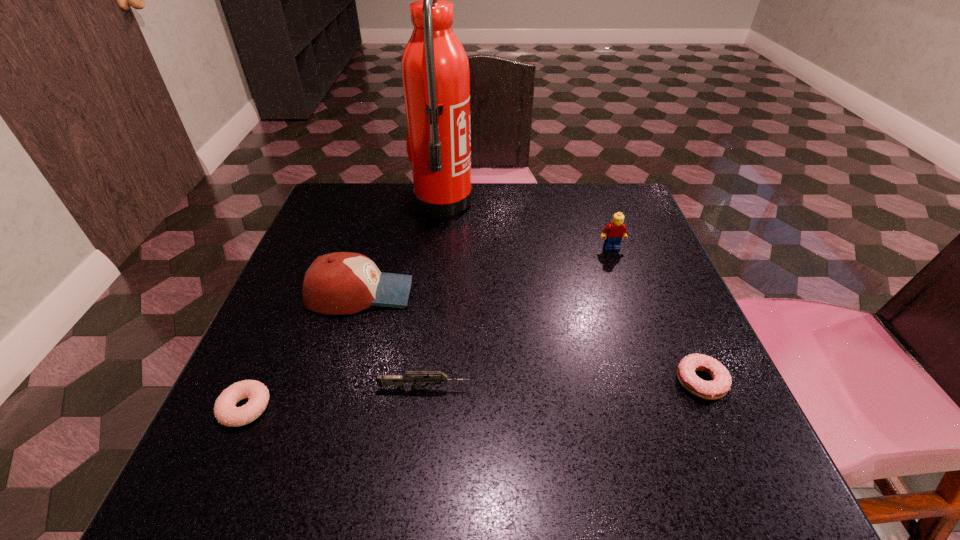
The image size is (960, 540). In the image, there is a desktop. In order to click on vacant area at the right edge in this screenshot , I will do `click(750, 436)`.

The height and width of the screenshot is (540, 960). What are the coordinates of `vacant space at the far right corner of the desktop` in the screenshot? It's located at (642, 226).

Where is `free space between the right doughnut and the fourth tallest object`? The image size is (960, 540). free space between the right doughnut and the fourth tallest object is located at coordinates coord(563,386).

You are a GUI agent. You are given a task and a screenshot of the screen. Output one action in this format:
    pyautogui.click(x=<x>, y=<y>)
    Task: Click on the free space that is in between the right doughnut and the Lego
    The image size is (960, 540).
    Given the screenshot: What is the action you would take?
    pyautogui.click(x=657, y=315)

This screenshot has width=960, height=540. I want to click on unoccupied area between the right doughnut and the baseball cap, so click(x=531, y=338).

Find the location of `blank region between the fifth nearest object and the fourth tallest object`. blank region between the fifth nearest object and the fourth tallest object is located at coordinates (517, 318).

The width and height of the screenshot is (960, 540). What are the coordinates of `vacant area that lies between the left doughnut and the second farthest object` in the screenshot? It's located at (428, 328).

At what (x,y) coordinates should I click in order to perform the action: click on vacant region between the Lego and the right doughnut. Please return your answer as a coordinate pair (x, y). This screenshot has width=960, height=540. Looking at the image, I should click on (657, 315).

I want to click on vacant area that lies between the right doughnut and the fourth nearest object, so click(531, 338).

Find the location of a particular element. unoccupied area between the left doughnut and the second farthest object is located at coordinates (x=428, y=328).